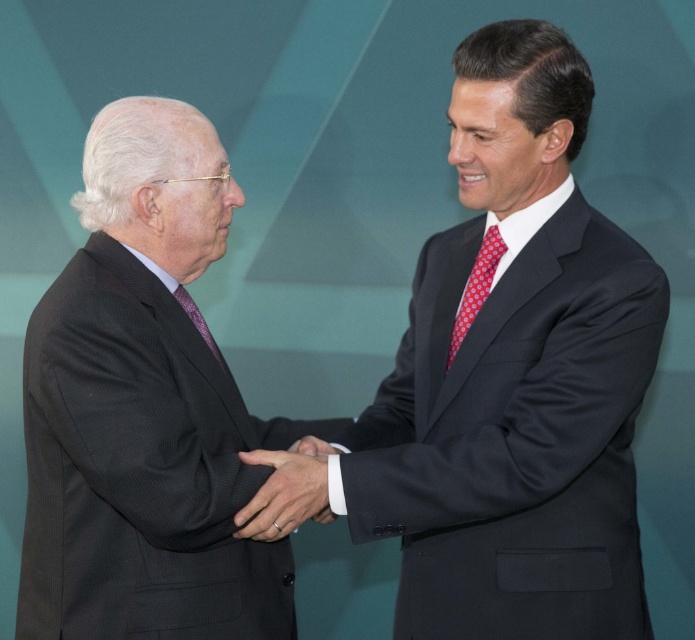
Question: Among these points, which one is nearest to the camera?

Choices:
 (A) (484, 289)
 (B) (449, 605)
 (C) (70, 381)

Answer: (C)

Question: Is red dotted tie at right positioned in front of white satin cuff at center?

Choices:
 (A) yes
 (B) no

Answer: (B)

Question: Which point is closer to the camera?

Choices:
 (A) (291, 506)
 (B) (322, 440)
 (C) (459, 324)

Answer: (A)

Question: Which is farther from the dark suit at right?

Choices:
 (A) dark gray suit at left
 (B) matte black suit at center
 (C) white satin cuff at center

Answer: (A)

Question: Does dark suit at right have a lesser width compared to matte black suit at center?

Choices:
 (A) no
 (B) yes

Answer: (A)

Question: Observing the image, what is the correct spatial positioning of dark suit at right in reference to red dotted tie at right?

Choices:
 (A) left
 (B) right

Answer: (B)